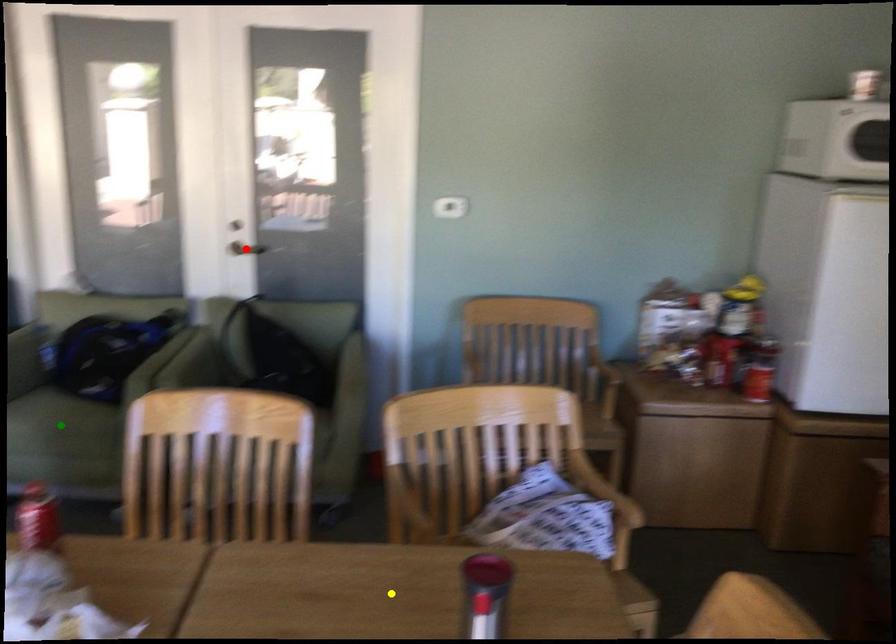
Order these from farthest to nearest:
- yellow point
- green point
- red point

1. red point
2. green point
3. yellow point